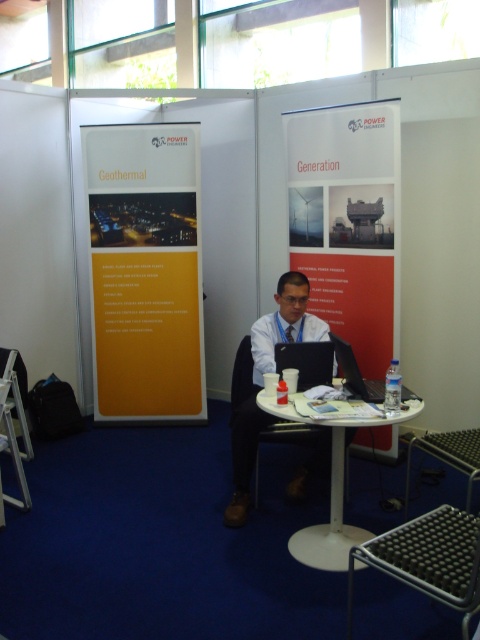
Question: Is white plastic table at center above metallic silver chair at left?

Choices:
 (A) no
 (B) yes

Answer: (A)

Question: Can you confirm if red matte poster at center is positioned to the left of black matte laptop at center?

Choices:
 (A) no
 (B) yes

Answer: (A)

Question: Which of the following is the farthest from the observer?

Choices:
 (A) (312, 358)
 (B) (336, 355)
 (C) (330, 445)
 (D) (323, 193)

Answer: (D)

Question: Estimate the real-world distances between objects in this image. Which object is farther from the metallic mesh chair at lower right?

Choices:
 (A) metallic silver chair at left
 (B) black plastic laptop at center
 (C) white plastic table at center

Answer: (A)

Question: Is matte black suit at center positioned before black matte laptop at center?

Choices:
 (A) yes
 (B) no

Answer: (B)

Question: Which of the following is the farthest from the observer?

Choices:
 (A) yellow matte poster at left
 (B) black matte laptop at center
 (C) black plastic laptop at center
 (D) metallic silver chair at left

Answer: (A)